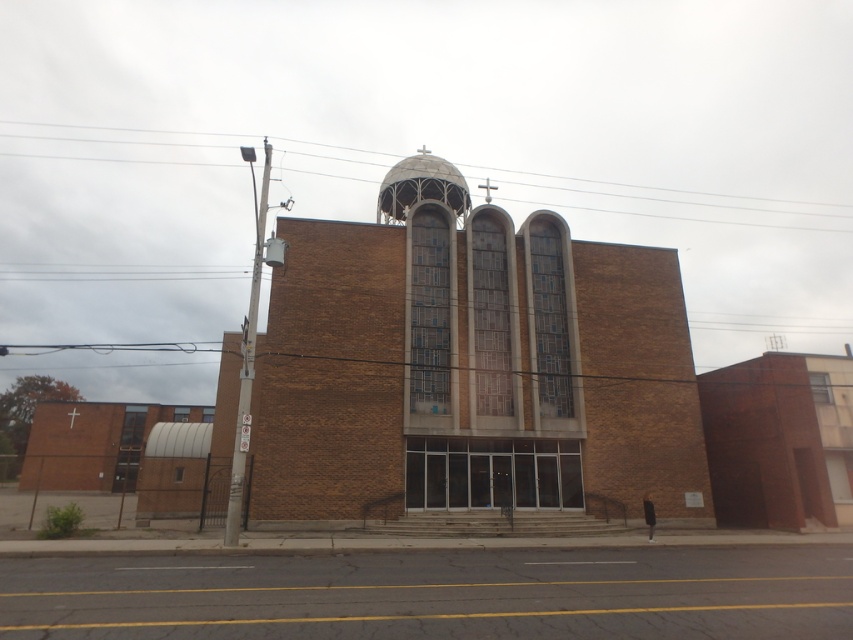
You are a visitor planning to attend a ceremony at the brown brick church at center. You notice another brown brick building at right nearby. Which building is wider from the front view?

The brown brick church at center is wider than the brown brick building at right from the front view.

You are standing in front of the brown brick church at center and the brown brick building at right. Which one is closer to you?

The brown brick church at center is closer to you because it is in front of the brown brick building at right.

You are a tourist standing in front of the brown brick church at center and the brown brick building at right. Which structure would you estimate to be bigger in size?

The brown brick church at center is larger in size than the brown brick building at right, so the church is bigger.